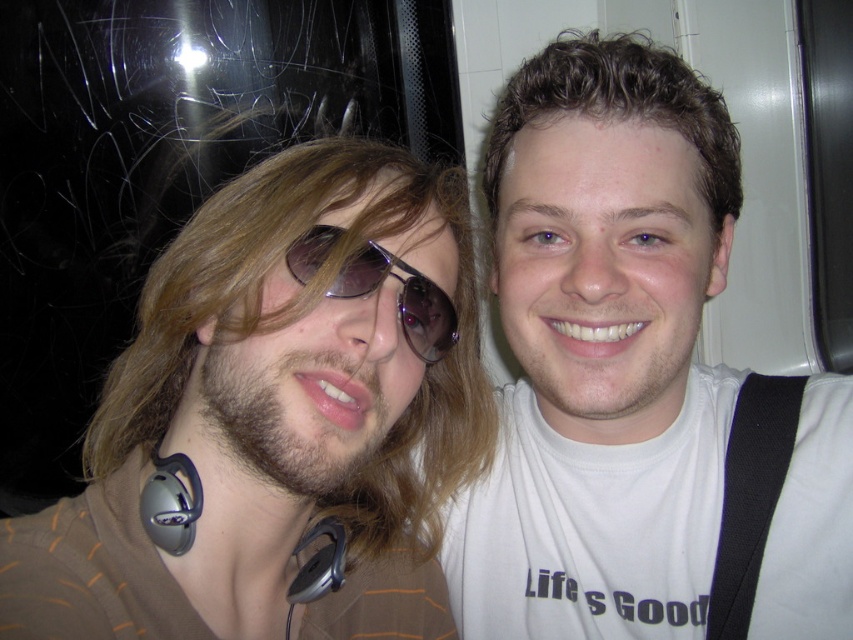
You are taking a photo of two people standing in front of you. There are two points marked on the image at coordinates point (657, 579) and point (325, 582). Which point is closer to the camera?

Point (325, 582) is closer to the camera because it is in front of point (657, 579).

You are taking a photo of two people. You notice the brown matte hair at left and the sunglasses at center. Which object is closer to the camera?

The brown matte hair at left is closer to the camera because it is in front of the sunglasses at center.